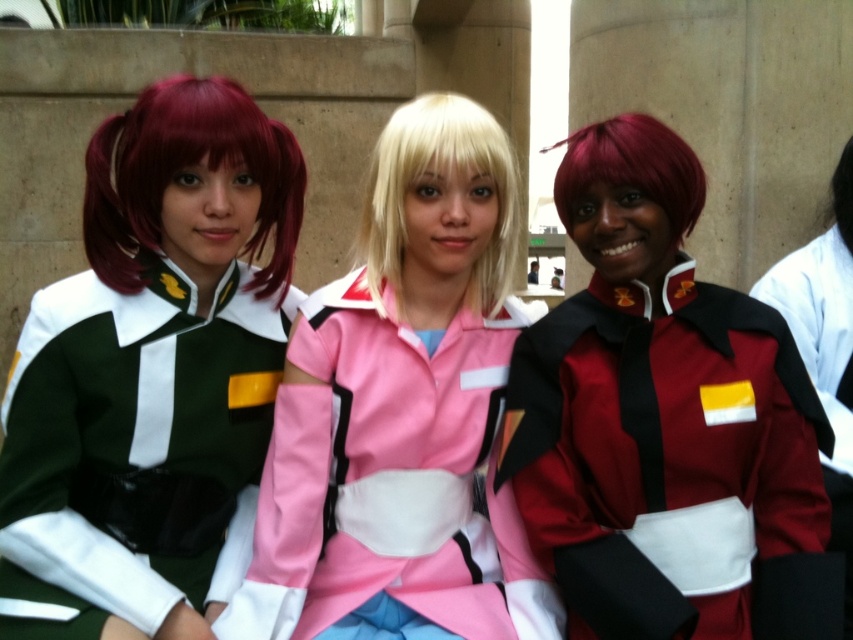
Between blonde silky hair at center and matte black jacket at center, which one has more height?

matte black jacket at center is taller.

Is blonde silky hair at center taller than matte black jacket at center?

Incorrect, blonde silky hair at center's height is not larger of matte black jacket at center's.

Is point (486, 138) in front of point (776, 262)?

That is True.

Where is `blonde silky hair at center`? blonde silky hair at center is located at coordinates (439, 177).

Is pink satin jacket at center below black silky hair at center?

Correct, pink satin jacket at center is located below black silky hair at center.

Is point (402, 188) less distant than point (837, 166)?

Yes.

This screenshot has height=640, width=853. What are the coordinates of `pink satin jacket at center` in the screenshot? It's located at pos(401,412).

Between shiny red wig at left and matte black jacket at center, which one is positioned higher?

Positioned higher is shiny red wig at left.

Does shiny red wig at left have a greater height compared to matte black jacket at center?

In fact, shiny red wig at left may be shorter than matte black jacket at center.

Is point (183, 109) closer to viewer compared to point (845, 266)?

Yes, it is in front of point (845, 266).

I want to click on shiny red wig at left, so (183, 168).